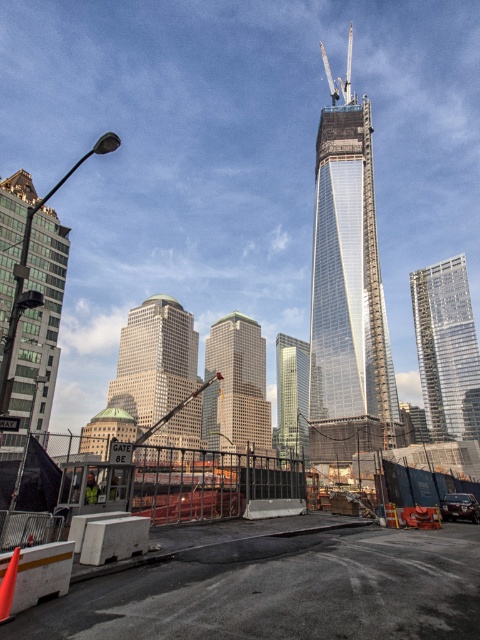
Question: Among these objects, which one is farthest from the camera?

Choices:
 (A) matte glass skyscraper at center
 (B) green glass skyscraper at left
 (C) concrete barrier at center

Answer: (A)

Question: Which object is the closest to the glassy reflective skyscraper at center?

Choices:
 (A) transparent glass skyscraper at center
 (B) green glass building at center
 (C) matte glass skyscraper at center

Answer: (B)

Question: Does concrete barrier at center have a larger size compared to matte glass skyscraper at center?

Choices:
 (A) yes
 (B) no

Answer: (A)

Question: Where is green glass skyscraper at left located in relation to glassy reflective skyscraper at center in the image?

Choices:
 (A) below
 (B) above

Answer: (B)

Question: Among these objects, which one is farthest from the camera?

Choices:
 (A) glassy reflective skyscraper at center
 (B) green glass skyscraper at left
 (C) concrete barrier at center

Answer: (A)

Question: Can you confirm if transparent glass skyscraper at center is positioned above yellow reflective safety vest at lower left?

Choices:
 (A) no
 (B) yes

Answer: (B)